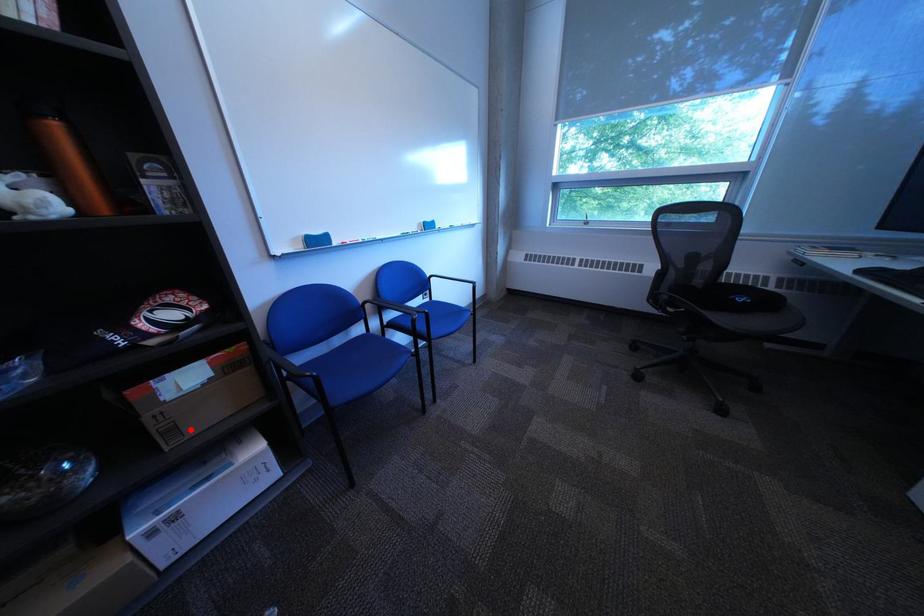
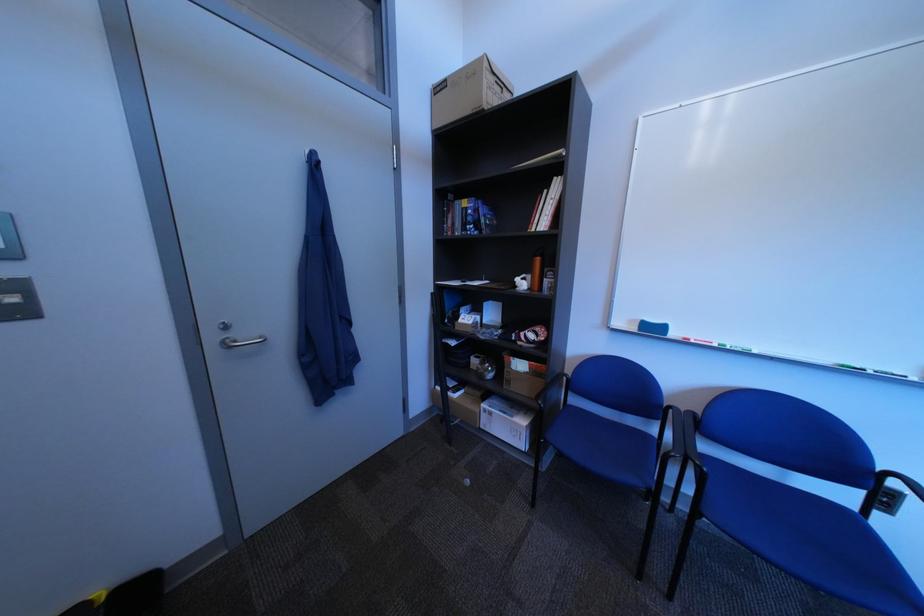
The point at the highlighted location is marked in the first image. Where is the corresponding point in the second image?

(525, 383)